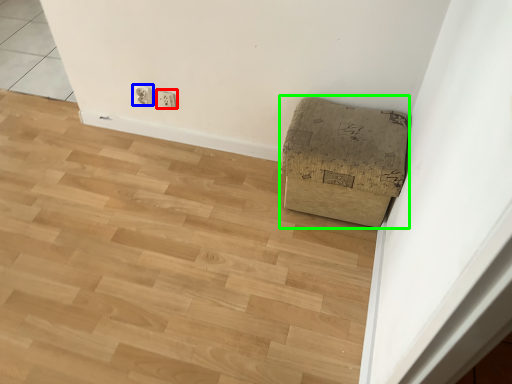
Question: Which is nearer to the electric outlet (highlighted by a red box)? electric outlet (highlighted by a blue box) or furniture (highlighted by a green box).

Choices:
 (A) electric outlet
 (B) furniture

Answer: (A)